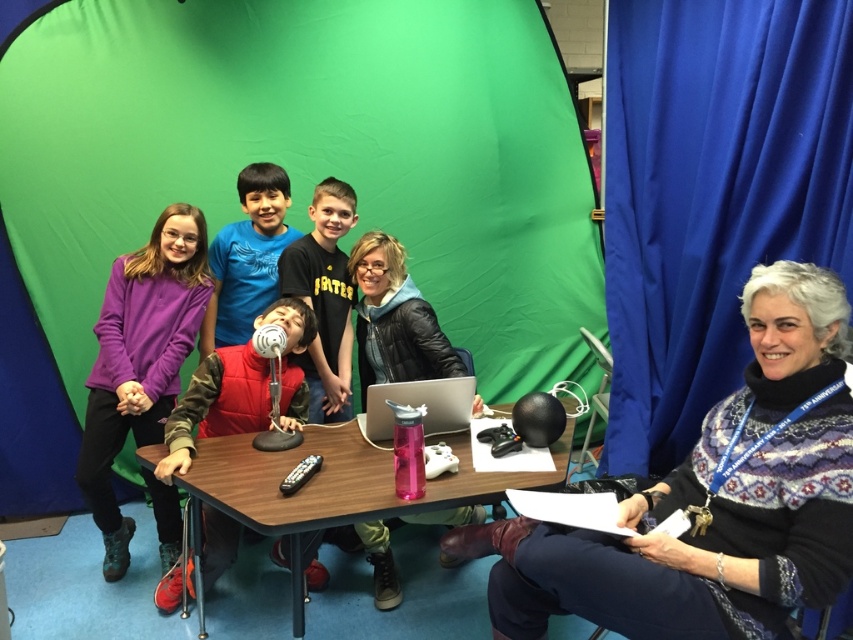
Does green fabric tent at center have a smaller size compared to velvet red vest at center?

No.

Can you confirm if green fabric tent at center is positioned to the right of velvet red vest at center?

No, green fabric tent at center is not to the right of velvet red vest at center.

Between point (503, 241) and point (252, 384), which one is positioned in front?

Point (252, 384)

Identify the location of green fabric tent at center. The width and height of the screenshot is (853, 640). (289, 176).

Between purple fleece sweater at left and velvet red vest at center, which one is positioned lower?

velvet red vest at center

Does purple fleece sweater at left have a greater height compared to velvet red vest at center?

Indeed, purple fleece sweater at left has a greater height compared to velvet red vest at center.

Measure the distance between purple fleece sweater at left and camera.

The distance of purple fleece sweater at left from camera is 2.62 meters.

This screenshot has width=853, height=640. In order to click on purple fleece sweater at left in this screenshot , I will do `click(140, 358)`.

Which is below, white wool sweater at right or silver metallic laptop at center?

Positioned lower is white wool sweater at right.

Is white wool sweater at right taller than silver metallic laptop at center?

Correct, white wool sweater at right is much taller as silver metallic laptop at center.

Who is more distant from viewer, (598,548) or (436,378)?

Positioned behind is point (436,378).

Locate an element on the screen. white wool sweater at right is located at coordinates (712, 499).